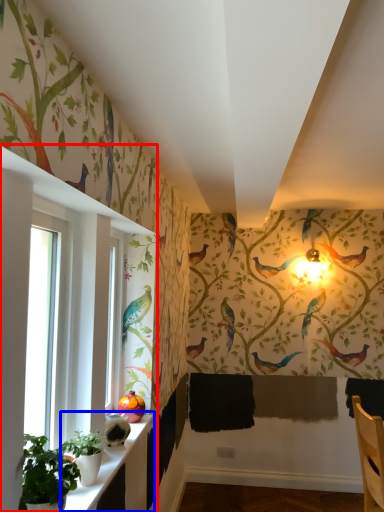
Question: Which point is closer to the camera, window (highlighted by a red box) or window sill (highlighted by a blue box)?

Choices:
 (A) window
 (B) window sill

Answer: (A)